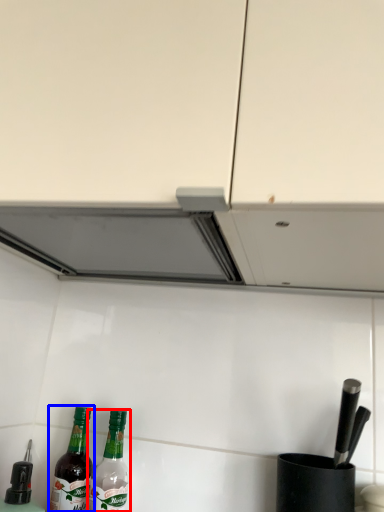
Question: Which object is closer to the camera taking this photo, bottle (highlighted by a red box) or bottle (highlighted by a blue box)?

Choices:
 (A) bottle
 (B) bottle

Answer: (A)